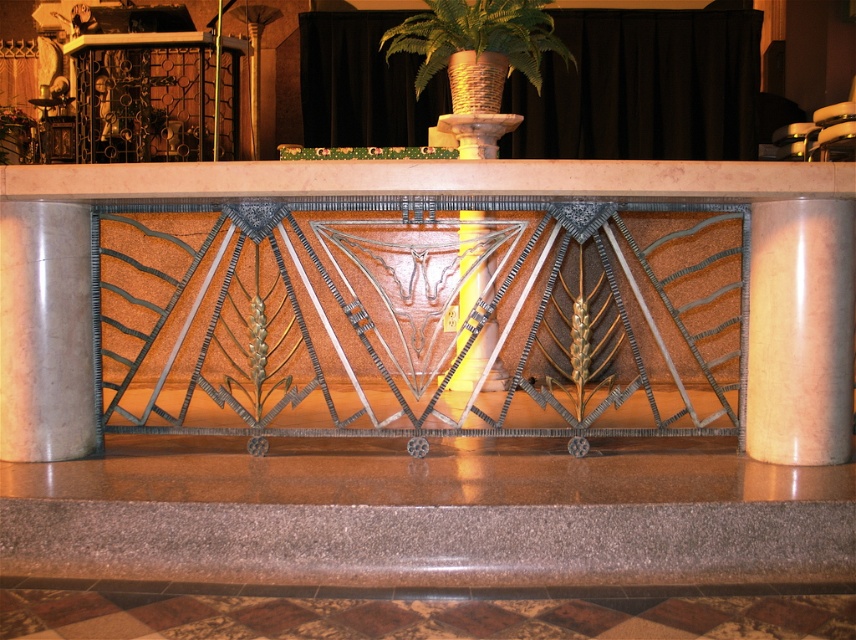
You are standing in the grand hall and notice two points marked on the marble surface near the decorative railing. The first point is at coordinate [477,17] and the second at [479,291]. From your perspective, which point is closer to you?

Point [477,17] is in front of point [479,291], so it is closer to you.

You are a stagehand needing to place a 1.2 meter wide equipment between the matte pink marble pillar at right and the metallic polished pillar at center. Can you fit it there?

The distance between the matte pink marble pillar at right and the metallic polished pillar at center is 1.08 meters, which is shorter than the 1.2 meter wide equipment. Therefore, the equipment cannot be placed between them.

You are an interior designer assessing the layout of this grand hall. You notice the matte pink marble pillar at right and the smooth marble pillar at left. Based on their positions, which pillar is positioned higher in the image?

The matte pink marble pillar at right is located above the smooth marble pillar at left, so it is positioned higher in the image.